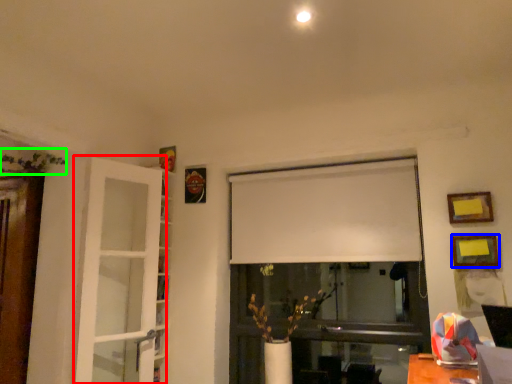
Question: Which object is positioned farthest from door (highlighted by a red box)? Select from picture frame (highlighted by a blue box) and plant (highlighted by a green box).

Choices:
 (A) picture frame
 (B) plant

Answer: (A)